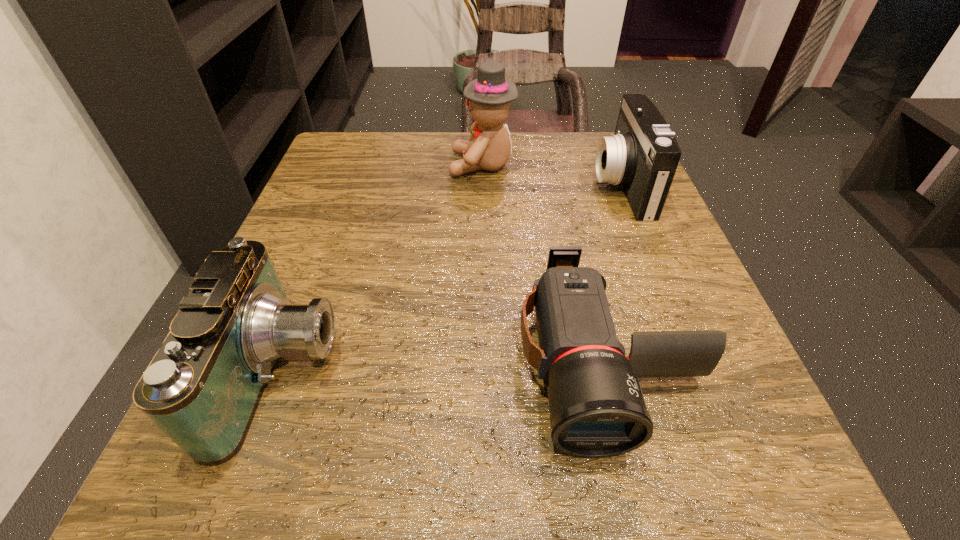
Where is `vacant region that satisfies the following two spatial constraints: 1. on the lens of the shortest camcorder; 2. on the front-facing side of the leftmost object`? Image resolution: width=960 pixels, height=540 pixels. vacant region that satisfies the following two spatial constraints: 1. on the lens of the shortest camcorder; 2. on the front-facing side of the leftmost object is located at coordinates (610, 373).